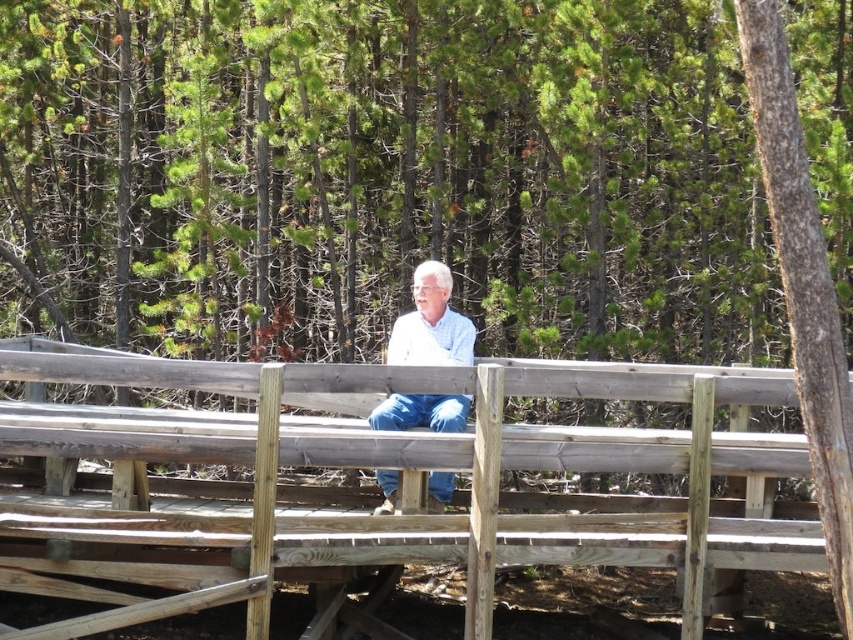
Is weathered wood rail at center behind light blue denim jeans at center?

No.

The image size is (853, 640). What do you see at coordinates (393, 467) in the screenshot?
I see `weathered wood rail at center` at bounding box center [393, 467].

Locate an element on the screen. The image size is (853, 640). weathered wood rail at center is located at coordinates (393, 467).